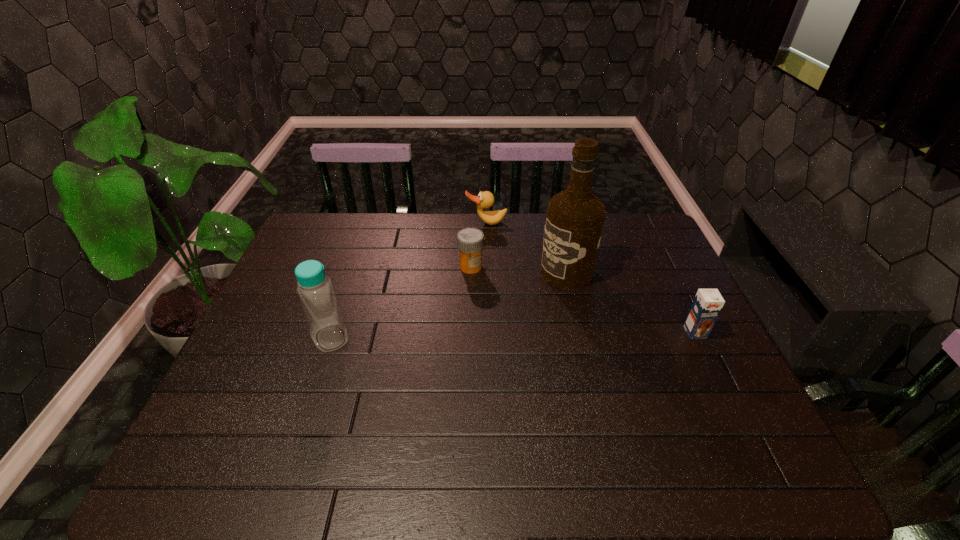
The width and height of the screenshot is (960, 540). I want to click on free space at the far edge, so click(468, 227).

This screenshot has height=540, width=960. I want to click on blank area at the near edge, so click(634, 416).

I want to click on vacant space at the left edge of the desktop, so click(x=326, y=267).

This screenshot has height=540, width=960. What are the coordinates of `vacant region at the right edge of the desktop` in the screenshot? It's located at (654, 320).

In the image, there is a desktop. In order to click on vacant space at the far left corner in this screenshot , I will do `click(314, 231)`.

Identify the location of free location at the near left corner of the desktop. This screenshot has width=960, height=540. (232, 422).

In the image, there is a desktop. Identify the location of free region at the far right corner. The height and width of the screenshot is (540, 960). (643, 232).

Image resolution: width=960 pixels, height=540 pixels. In the image, there is a desktop. What are the coordinates of `vacant space at the near right corner` in the screenshot? It's located at (687, 426).

What are the coordinates of `vacant area that lies between the chocolate milk and the medicine` in the screenshot? It's located at (583, 299).

This screenshot has width=960, height=540. Find the location of `vacant space that's between the chocolate milk and the alcohol`. vacant space that's between the chocolate milk and the alcohol is located at coordinates point(631,302).